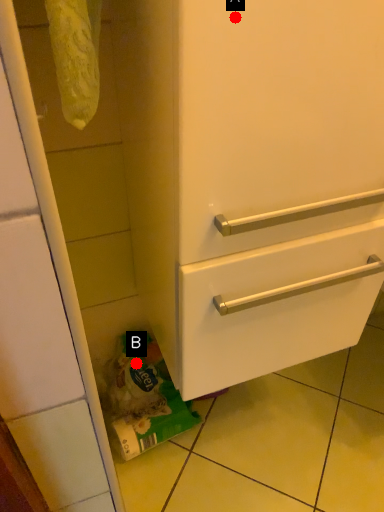
Question: Two points are circled on the image, labeled by A and B beside each circle. Which point is further to the camera?

Choices:
 (A) A is further
 (B) B is further

Answer: (B)